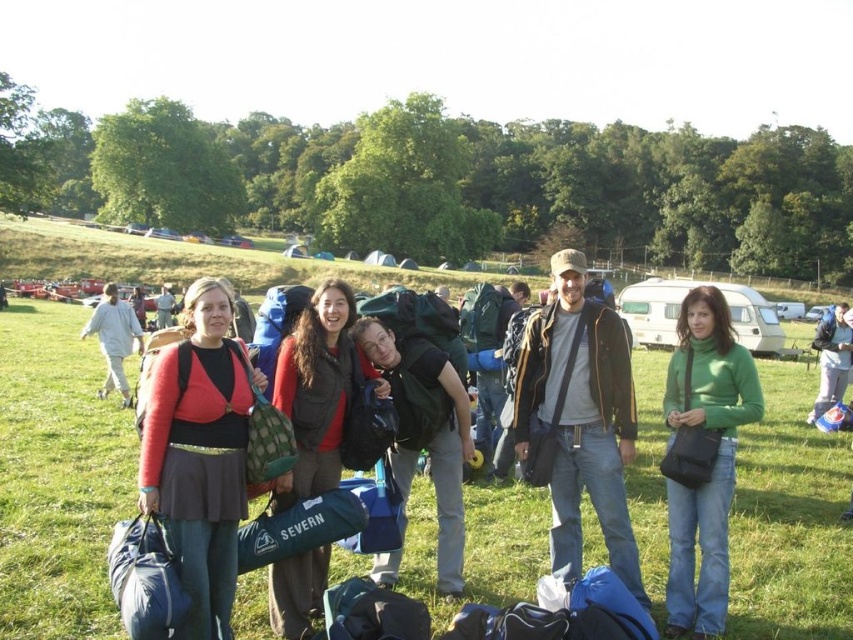
You are standing in the camping area and see the matte red jacket at center. If you want to reach it within 10 seconds, what is the minimum speed you need to walk at?

The matte red jacket at center is 7.17 meters away from viewer. To reach it in 10 seconds, you need to walk at a minimum speed of 0.717 meters per second.

You are a drone operator trying to capture a photo of the group in the camping scene. The drone is currently hovering at point coordinates of 0.5, 0.5. To get the best shot, you need to adjust the drone to the same position as the green grass at center. What coordinates should you set the drone to?

The green grass at center is located at position coordinates of (57, 476). Therefore, to align the drone with the green grass at center for the best shot, you should set the drone to those coordinates.